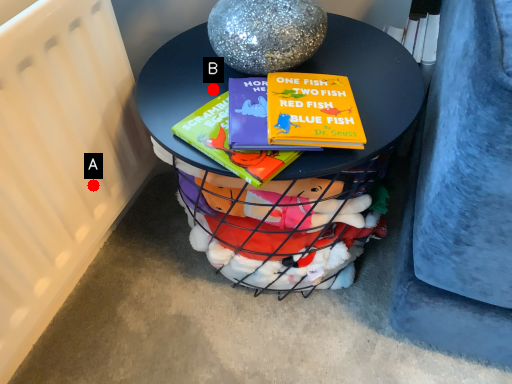
Question: Two points are circled on the image, labeled by A and B beside each circle. Which point appears closest to the camera in this image?

Choices:
 (A) A is closer
 (B) B is closer

Answer: (B)